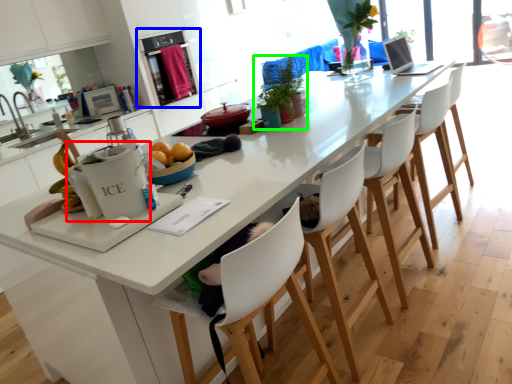
Question: Which object is the closest to the appliance (highlighted by a red box)? Choose among these: kitchen appliance (highlighted by a blue box) or houseplant (highlighted by a green box).

Choices:
 (A) kitchen appliance
 (B) houseplant

Answer: (B)